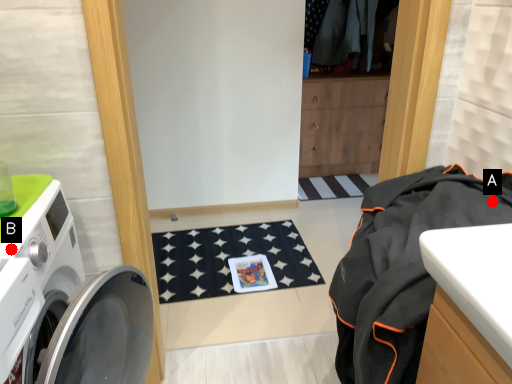
Question: Two points are circled on the image, labeled by A and B beside each circle. Which point is closer to the camera?

Choices:
 (A) A is closer
 (B) B is closer

Answer: (B)